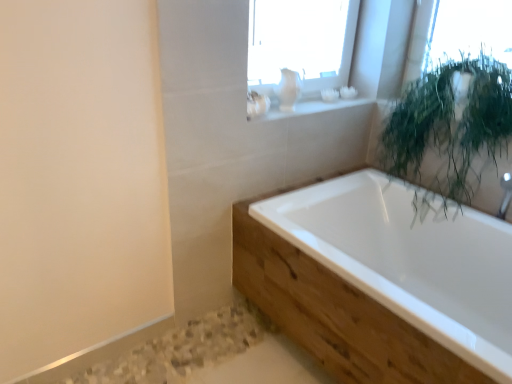
Question: Can you confirm if white glossy bathtub at center is taller than green leafy plant at upper right?

Choices:
 (A) no
 (B) yes

Answer: (A)

Question: Does white glossy bathtub at center have a smaller size compared to green leafy plant at upper right?

Choices:
 (A) no
 (B) yes

Answer: (A)

Question: From a real-world perspective, does white glossy bathtub at center sit lower than green leafy plant at upper right?

Choices:
 (A) no
 (B) yes

Answer: (B)

Question: Are white glossy bathtub at center and green leafy plant at upper right making contact?

Choices:
 (A) yes
 (B) no

Answer: (B)

Question: Is white glossy bathtub at center further to camera compared to green leafy plant at upper right?

Choices:
 (A) yes
 (B) no

Answer: (B)

Question: From the image's perspective, is white glossy bathtub at center under green leafy plant at upper right?

Choices:
 (A) no
 (B) yes

Answer: (B)

Question: From a real-world perspective, is white glossy bathtub at center located beneath white ceramic vase at upper center?

Choices:
 (A) no
 (B) yes

Answer: (B)

Question: Is white glossy bathtub at center facing towards white ceramic vase at upper center?

Choices:
 (A) yes
 (B) no

Answer: (B)

Question: From a real-world perspective, is white glossy bathtub at center positioned over white ceramic vase at upper center based on gravity?

Choices:
 (A) no
 (B) yes

Answer: (A)

Question: Can you confirm if white glossy bathtub at center is shorter than white ceramic vase at upper center?

Choices:
 (A) no
 (B) yes

Answer: (A)

Question: Is white ceramic vase at upper center located within white glossy bathtub at center?

Choices:
 (A) yes
 (B) no

Answer: (B)

Question: Can you confirm if white glossy bathtub at center is wider than white ceramic vase at upper center?

Choices:
 (A) yes
 (B) no

Answer: (A)

Question: Is white ceramic vase at upper center further to camera compared to white glossy bathtub at center?

Choices:
 (A) yes
 (B) no

Answer: (A)